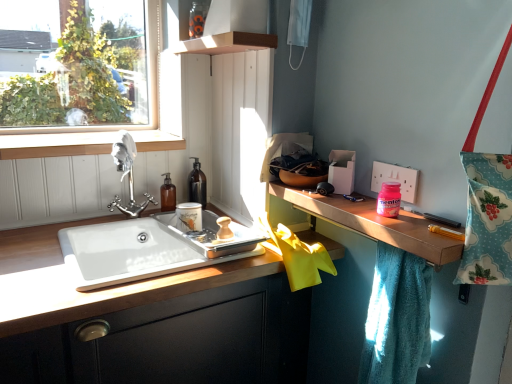
Identify the location of free space behind pink glossy mentos at upper right, which appears as the second toiletry when viewed from the left. This screenshot has height=384, width=512. (359, 202).